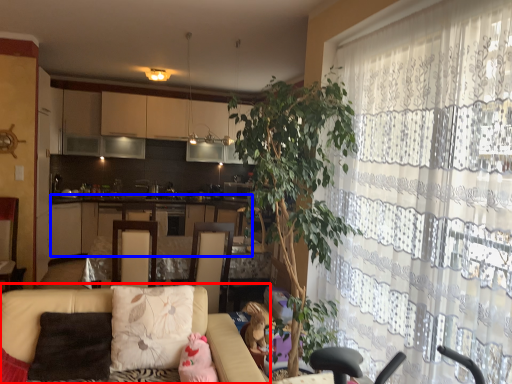
Question: Among these objects, which one is nearest to the camera, studio couch (highlighted by a red box) or cabinetry (highlighted by a blue box)?

Choices:
 (A) studio couch
 (B) cabinetry

Answer: (A)